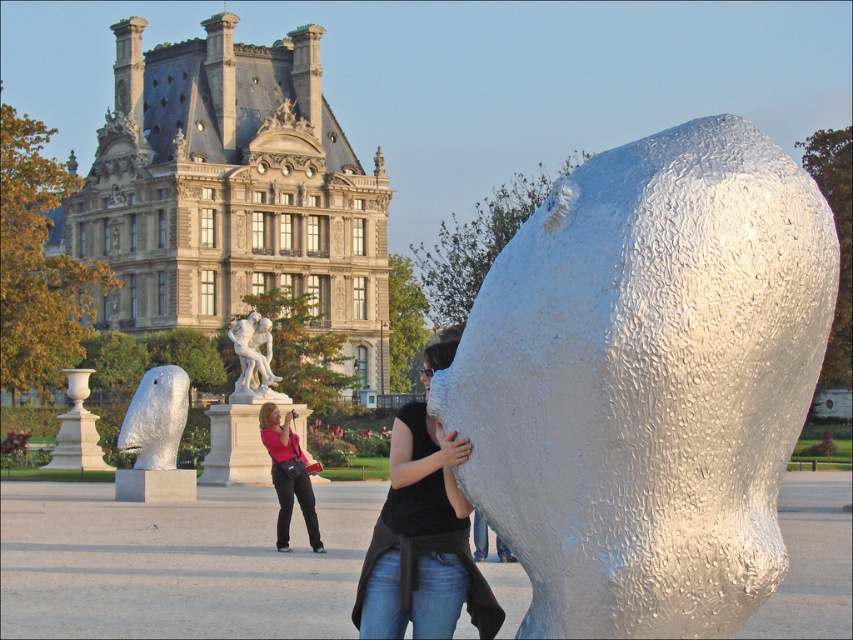
Consider the image. You are standing at the point marked as point (231, 193) in the image. Based on the scene description, what structure are you currently located on?

The point (231, 193) is located on the beige stone palace at upper left.

You are an art student who wants to take a photo of both the silver textured head at left and the white marble statue at center. Based on their positions, which one should you focus on first to ensure both are in the frame?

The silver textured head at left is located below the white marble statue at center, so you should focus on the white marble statue at center first to ensure both are in the frame.